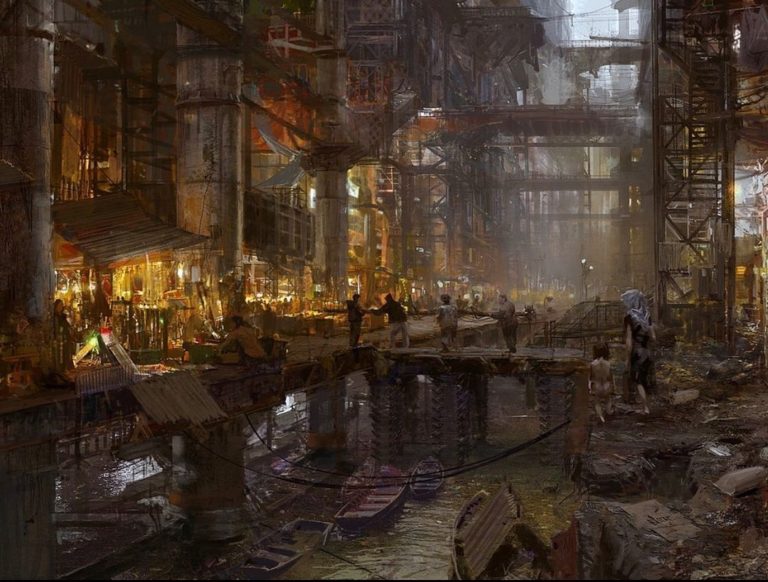
Image resolution: width=768 pixels, height=582 pixels. I want to click on light, so click(154, 276), click(348, 229), click(260, 281).